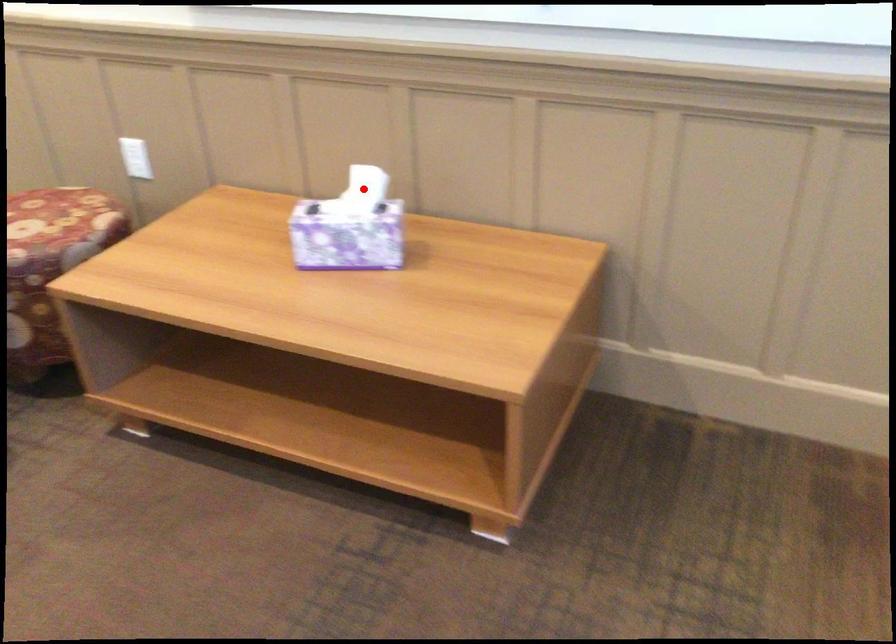
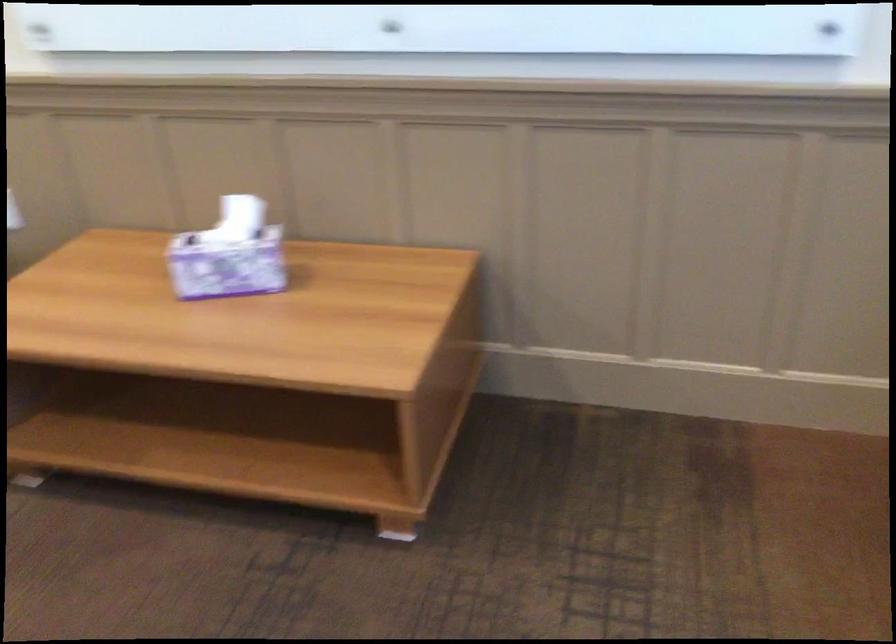
Locate, in the second image, the point that corresponds to the highlighted location in the first image.

(239, 218)